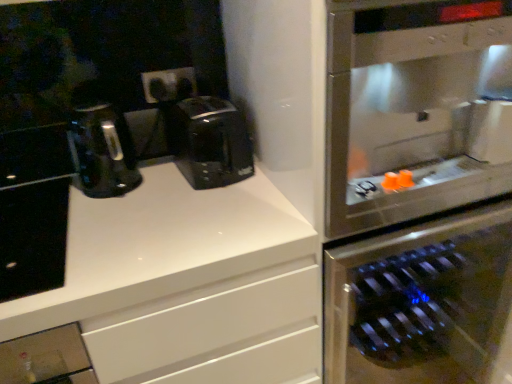
The height and width of the screenshot is (384, 512). Find the location of `vacant area that is in front of black plastic coffee maker at center`. vacant area that is in front of black plastic coffee maker at center is located at coordinates (203, 210).